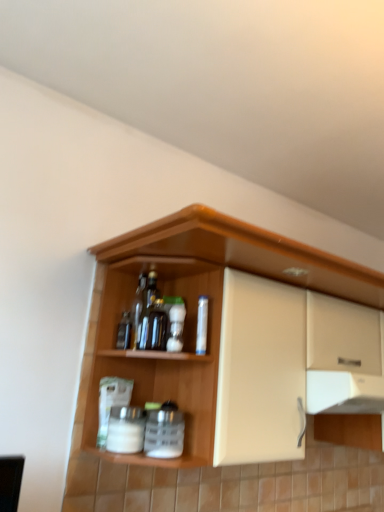
Question: Is wooden cabinet at upper center positioned behind white plastic spice container at center, which is the second beverage in left-to-right order?

Choices:
 (A) no
 (B) yes

Answer: (A)

Question: Is wooden cabinet at upper center positioned beyond the bounds of white plastic spice container at center, which is the second beverage in left-to-right order?

Choices:
 (A) yes
 (B) no

Answer: (A)

Question: Can you confirm if wooden cabinet at upper center is positioned to the right of white plastic spice container at center, which is the second beverage in left-to-right order?

Choices:
 (A) no
 (B) yes

Answer: (B)

Question: From a real-world perspective, is wooden cabinet at upper center physically below white plastic spice container at center, which is the second beverage in left-to-right order?

Choices:
 (A) no
 (B) yes

Answer: (A)

Question: Does wooden cabinet at upper center have a smaller size compared to white plastic spice container at center, which is the second beverage in left-to-right order?

Choices:
 (A) no
 (B) yes

Answer: (A)

Question: From the image's perspective, is wooden cabinet at upper center beneath white plastic spice container at center, which is the second beverage in left-to-right order?

Choices:
 (A) no
 (B) yes

Answer: (A)

Question: From the image's perspective, is wooden cabinet at upper center on top of clear plastic bottle at center, the 1th bottle from the right?

Choices:
 (A) no
 (B) yes

Answer: (A)

Question: From a real-world perspective, is wooden cabinet at upper center over clear plastic bottle at center, the 2th bottle viewed from the left?

Choices:
 (A) no
 (B) yes

Answer: (A)

Question: From the image's perspective, is wooden cabinet at upper center under clear plastic bottle at center, the 1th bottle from the right?

Choices:
 (A) yes
 (B) no

Answer: (A)

Question: Considering the relative sizes of wooden cabinet at upper center and clear plastic bottle at center, the 2th bottle viewed from the left, in the image provided, is wooden cabinet at upper center shorter than clear plastic bottle at center, the 2th bottle viewed from the left,?

Choices:
 (A) yes
 (B) no

Answer: (B)

Question: Is wooden cabinet at upper center completely or partially outside of clear plastic bottle at center, the 1th bottle from the right?

Choices:
 (A) no
 (B) yes

Answer: (B)

Question: Does wooden cabinet at upper center have a smaller size compared to clear plastic bottle at center, the 1th bottle from the right?

Choices:
 (A) yes
 (B) no

Answer: (B)

Question: Does white matte jar at lower center, positioned as the second beverage in right-to-left order, have a smaller size compared to white plastic spice container at center, which is the second beverage in left-to-right order?

Choices:
 (A) yes
 (B) no

Answer: (A)